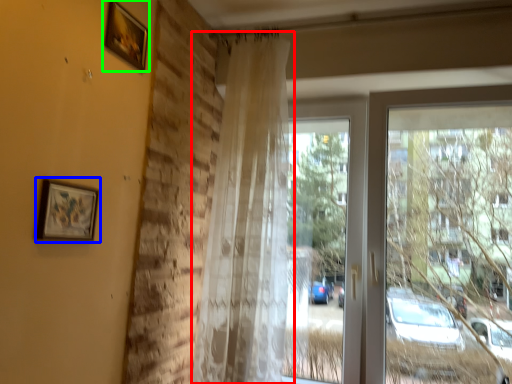
Question: Based on their relative distances, which object is farther from curtain (highlighted by a red box)? Choose from picture frame (highlighted by a blue box) and picture frame (highlighted by a green box).

Choices:
 (A) picture frame
 (B) picture frame

Answer: (A)